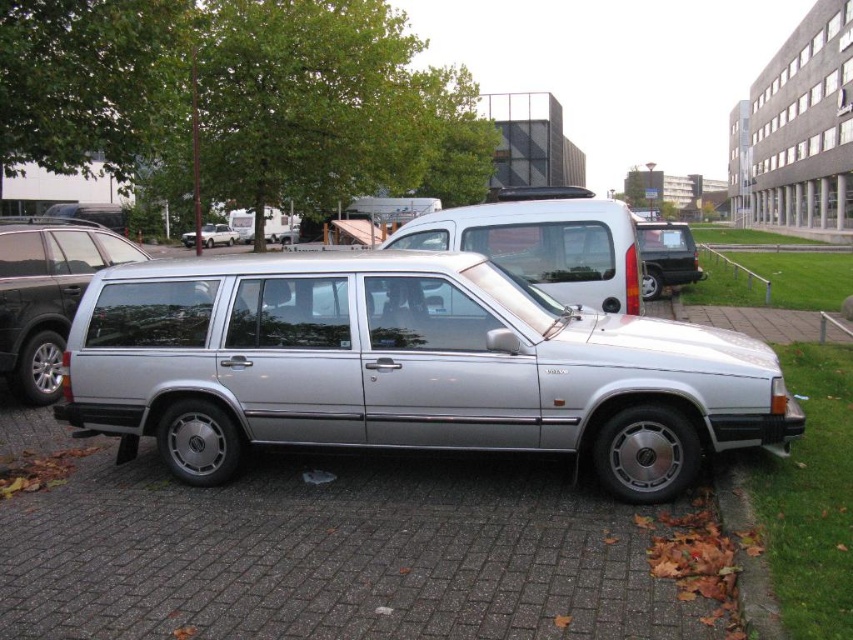
Question: Does gray brick pavement at center have a smaller size compared to silver metallic van at center?

Choices:
 (A) yes
 (B) no

Answer: (A)

Question: Is silver metallic van at center to the left of silver metallic minivan at left from the viewer's perspective?

Choices:
 (A) yes
 (B) no

Answer: (B)

Question: Which point is closer to the camera?

Choices:
 (A) (50, 317)
 (B) (189, 243)

Answer: (A)

Question: Does silver metallic station wagon at center have a larger size compared to satin silver station wagon at center?

Choices:
 (A) yes
 (B) no

Answer: (A)

Question: Considering the real-world distances, which object is closest to the gray brick pavement at center?

Choices:
 (A) silver metallic station wagon at center
 (B) satin silver station wagon at center
 (C) silver metallic minivan at left
 (D) matte black suv at right

Answer: (A)

Question: Estimate the real-world distances between objects in this image. Which object is closer to the silver metallic van at center?

Choices:
 (A) silver metallic minivan at left
 (B) gray brick pavement at center
 (C) satin silver station wagon at center

Answer: (B)